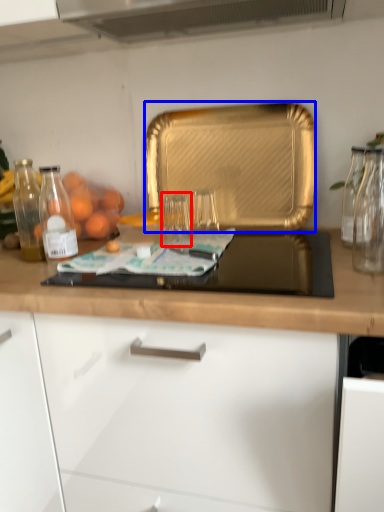
Question: Which of the following is the farthest to the observer, glass jar (highlighted by a red box) or kitchen appliance (highlighted by a blue box)?

Choices:
 (A) glass jar
 (B) kitchen appliance

Answer: (B)